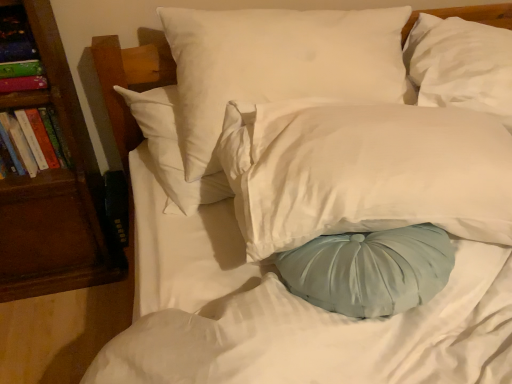
Locate an element on the screen. This screenshot has height=384, width=512. white satin pillow at upper right, the first pillow positioned from the right is located at coordinates click(x=461, y=65).

Find the location of a particular element. The height and width of the screenshot is (384, 512). multicolored paper book at left, the first book when ordered from top to bottom is located at coordinates (18, 53).

Locate an element on the screen. The image size is (512, 384). hardcover book at left, arranged as the 2th book when viewed from the top is located at coordinates (36, 139).

The height and width of the screenshot is (384, 512). Describe the element at coordinates (36, 139) in the screenshot. I see `hardcover book at left, arranged as the 2th book when viewed from the top` at that location.

Locate an element on the screen. The image size is (512, 384). white satin pillow at center, the second pillow viewed from the right is located at coordinates (364, 171).

This screenshot has width=512, height=384. Identify the location of white satin pillow at upper right, the first pillow positioned from the right. coord(461,65).

From the image's perspective, is white satin pillow at center, the second pillow viewed from the right, above white satin pillow at upper right, the first pillow positioned from the right?

No, from the image's perspective, white satin pillow at center, the second pillow viewed from the right, is not over white satin pillow at upper right, the first pillow positioned from the right.

Which is correct: white satin pillow at center, the second pillow viewed from the right, is inside white satin pillow at upper right, which is the 3th pillow in left-to-right order, or outside of it?

white satin pillow at center, the second pillow viewed from the right, is located beyond the bounds of white satin pillow at upper right, which is the 3th pillow in left-to-right order.

Is point (255, 147) less distant than point (453, 77)?

Yes, it is.

Who is shorter, brown wood bookshelf at left or multicolored paper book at left, the 2th book ordered from the bottom?

multicolored paper book at left, the 2th book ordered from the bottom.

Between brown wood bookshelf at left and multicolored paper book at left, the 2th book ordered from the bottom, which one has smaller size?

With smaller size is multicolored paper book at left, the 2th book ordered from the bottom.

Identify the location of book that is the 2nd object above the brown wood bookshelf at left (from a real-world perspective). This screenshot has width=512, height=384. (18, 53).

Which object is wider, brown wood bookshelf at left or multicolored paper book at left, the first book when ordered from top to bottom?

With larger width is brown wood bookshelf at left.

Does hardcover book at left, the 1th book when ordered from bottom to top, have a larger size compared to white satin pillow at center, arranged as the 2th pillow when viewed from the left?

No, hardcover book at left, the 1th book when ordered from bottom to top, is not bigger than white satin pillow at center, arranged as the 2th pillow when viewed from the left.

Can you confirm if hardcover book at left, arranged as the 2th book when viewed from the top, is positioned to the left of white satin pillow at center, the second pillow viewed from the right?

Yes.

Is hardcover book at left, arranged as the 2th book when viewed from the top, further to camera compared to white satin pillow at center, the second pillow viewed from the right?

Yes, it is.

Does hardcover book at left, arranged as the 2th book when viewed from the top, touch white satin pillow at center, the second pillow viewed from the right?

hardcover book at left, arranged as the 2th book when viewed from the top, is not next to white satin pillow at center, the second pillow viewed from the right, and they're not touching.

From a real-world perspective, is hardcover book at left, arranged as the 2th book when viewed from the top, under white satin pillow at upper right, the first pillow positioned from the right?

Yes.

Who is bigger, hardcover book at left, arranged as the 2th book when viewed from the top, or white satin pillow at upper right, the first pillow positioned from the right?

white satin pillow at upper right, the first pillow positioned from the right, is bigger.

Is hardcover book at left, arranged as the 2th book when viewed from the top, facing towards white satin pillow at upper right, which is the 3th pillow in left-to-right order?

No, hardcover book at left, arranged as the 2th book when viewed from the top, does not turn towards white satin pillow at upper right, which is the 3th pillow in left-to-right order.

From the image's perspective, which is below, hardcover book at left, arranged as the 2th book when viewed from the top, or white satin pillow at upper right, the first pillow positioned from the right?

hardcover book at left, arranged as the 2th book when viewed from the top, from the image's perspective.

Can you confirm if hardcover book at left, arranged as the 2th book when viewed from the top, is thinner than multicolored paper book at left, the 2th book ordered from the bottom?

No.

Is point (51, 129) closer or farther from the camera than point (8, 66)?

Point (51, 129).

Which is behind, hardcover book at left, the 1th book when ordered from bottom to top, or multicolored paper book at left, the first book when ordered from top to bottom?

hardcover book at left, the 1th book when ordered from bottom to top, is behind.

Does hardcover book at left, the 1th book when ordered from bottom to top, turn towards multicolored paper book at left, the first book when ordered from top to bottom?

No, hardcover book at left, the 1th book when ordered from bottom to top, is not facing towards multicolored paper book at left, the first book when ordered from top to bottom.

From a real-world perspective, is brown wood bookshelf at left physically located above or below hardcover book at left, the 1th book when ordered from bottom to top?

In terms of real-world spatial position, brown wood bookshelf at left is below hardcover book at left, the 1th book when ordered from bottom to top.

From the image's perspective, who appears lower, brown wood bookshelf at left or hardcover book at left, arranged as the 2th book when viewed from the top?

brown wood bookshelf at left, from the image's perspective.

Can you confirm if brown wood bookshelf at left is shorter than hardcover book at left, arranged as the 2th book when viewed from the top?

Incorrect, the height of brown wood bookshelf at left does not fall short of that of hardcover book at left, arranged as the 2th book when viewed from the top.

From the image's perspective, count 1st books upward from the brown wood bookshelf at left and point to it. Please provide its 2D coordinates.

[(36, 139)]

From the image's perspective, is white smooth pillow at upper center, the 1th pillow in the left-to-right sequence, positioned above or below multicolored paper book at left, the 2th book ordered from the bottom?

From the image's perspective, white smooth pillow at upper center, the 1th pillow in the left-to-right sequence, appears below multicolored paper book at left, the 2th book ordered from the bottom.

From the white smooth pillow at upper center, the 1th pillow in the left-to-right sequence, count 1st books backward and point to it. Please provide its 2D coordinates.

[(18, 53)]

Which is closer, (x=271, y=47) or (x=4, y=49)?

Point (x=271, y=47) is farther from the camera than point (x=4, y=49).

Could you tell me if white smooth pillow at upper center, the 1th pillow in the left-to-right sequence, is turned towards multicolored paper book at left, the 2th book ordered from the bottom?

No, white smooth pillow at upper center, the 1th pillow in the left-to-right sequence, is not aimed at multicolored paper book at left, the 2th book ordered from the bottom.

Where is `the 2nd pillow behind the white satin pillow at center, arranged as the 2th pillow when viewed from the left, counting from the anchor's position`? The height and width of the screenshot is (384, 512). the 2nd pillow behind the white satin pillow at center, arranged as the 2th pillow when viewed from the left, counting from the anchor's position is located at coordinates (461, 65).

Image resolution: width=512 pixels, height=384 pixels. In order to click on the 1st book counting from the right of the brown wood bookshelf at left in this screenshot , I will do `click(18, 53)`.

Which object lies nearer to the anchor point hardcover book at left, the 1th book when ordered from bottom to top, multicolored paper book at left, the first book when ordered from top to bottom, or white smooth pillow at upper center, the 1th pillow in the left-to-right sequence?

multicolored paper book at left, the first book when ordered from top to bottom, is positioned closer to the anchor hardcover book at left, the 1th book when ordered from bottom to top.

From the image, which object appears to be nearer to white smooth pillow at upper center, the 1th pillow in the left-to-right sequence, brown wood bookshelf at left or white satin pillow at upper right, which is the 3th pillow in left-to-right order?

Based on the image, white satin pillow at upper right, which is the 3th pillow in left-to-right order, appears to be nearer to white smooth pillow at upper center, the 1th pillow in the left-to-right sequence.

Based on their spatial positions, is hardcover book at left, arranged as the 2th book when viewed from the top, or white satin pillow at upper right, which is the 3th pillow in left-to-right order, closer to brown wood bookshelf at left?

hardcover book at left, arranged as the 2th book when viewed from the top, lies closer to brown wood bookshelf at left than the other object.

Which object lies further to the anchor point brown wood bookshelf at left, white satin pillow at upper right, the first pillow positioned from the right, or white smooth pillow at upper center, the 3th pillow when ordered from right to left?

white satin pillow at upper right, the first pillow positioned from the right, is positioned further to the anchor brown wood bookshelf at left.

Considering their positions, is hardcover book at left, the 1th book when ordered from bottom to top, positioned further to white smooth pillow at upper center, the 3th pillow when ordered from right to left, than multicolored paper book at left, the 2th book ordered from the bottom?

hardcover book at left, the 1th book when ordered from bottom to top, lies further to white smooth pillow at upper center, the 3th pillow when ordered from right to left, than the other object.

Based on their spatial positions, is multicolored paper book at left, the 2th book ordered from the bottom, or brown wood bookshelf at left further from white satin pillow at upper right, which is the 3th pillow in left-to-right order?

The object further to white satin pillow at upper right, which is the 3th pillow in left-to-right order, is brown wood bookshelf at left.

When comparing their distances from multicolored paper book at left, the first book when ordered from top to bottom, does white satin pillow at center, the second pillow viewed from the right, or hardcover book at left, arranged as the 2th book when viewed from the top, seem closer?

hardcover book at left, arranged as the 2th book when viewed from the top, is closer to multicolored paper book at left, the first book when ordered from top to bottom.

Looking at this image, from the image, which object appears to be farther from hardcover book at left, arranged as the 2th book when viewed from the top, brown wood bookshelf at left or white satin pillow at center, arranged as the 2th pillow when viewed from the left?

white satin pillow at center, arranged as the 2th pillow when viewed from the left, is further to hardcover book at left, arranged as the 2th book when viewed from the top.

This screenshot has height=384, width=512. I want to click on pillow between white smooth pillow at upper center, the 1th pillow in the left-to-right sequence, and white satin pillow at upper right, the first pillow positioned from the right, in the horizontal direction, so click(364, 171).

At what (x,y) coordinates should I click in order to perform the action: click on pillow between hardcover book at left, arranged as the 2th book when viewed from the top, and white satin pillow at center, arranged as the 2th pillow when viewed from the left. Please return your answer as a coordinate pair (x, y). The width and height of the screenshot is (512, 384). Looking at the image, I should click on (276, 64).

You are a GUI agent. You are given a task and a screenshot of the screen. Output one action in this format:
    pyautogui.click(x=<x>, y=<y>)
    Task: Click on the book located between multicolored paper book at left, the first book when ordered from top to bottom, and white smooth pillow at upper center, the 3th pillow when ordered from right to left, in the left-right direction
    This screenshot has width=512, height=384.
    Given the screenshot: What is the action you would take?
    pyautogui.click(x=36, y=139)

Locate an element on the screen. book between multicolored paper book at left, the 2th book ordered from the bottom, and white satin pillow at upper right, which is the 3th pillow in left-to-right order, from left to right is located at coordinates (36, 139).